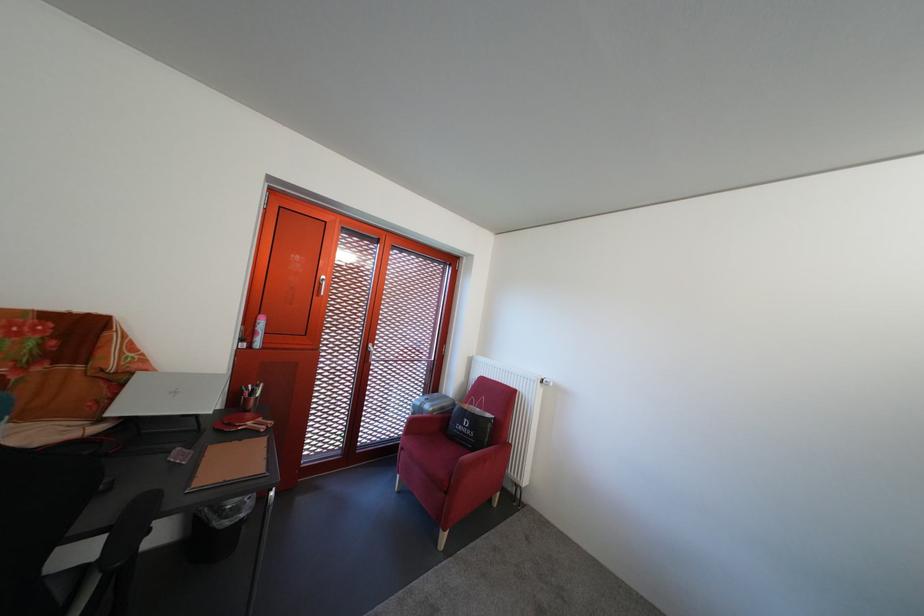
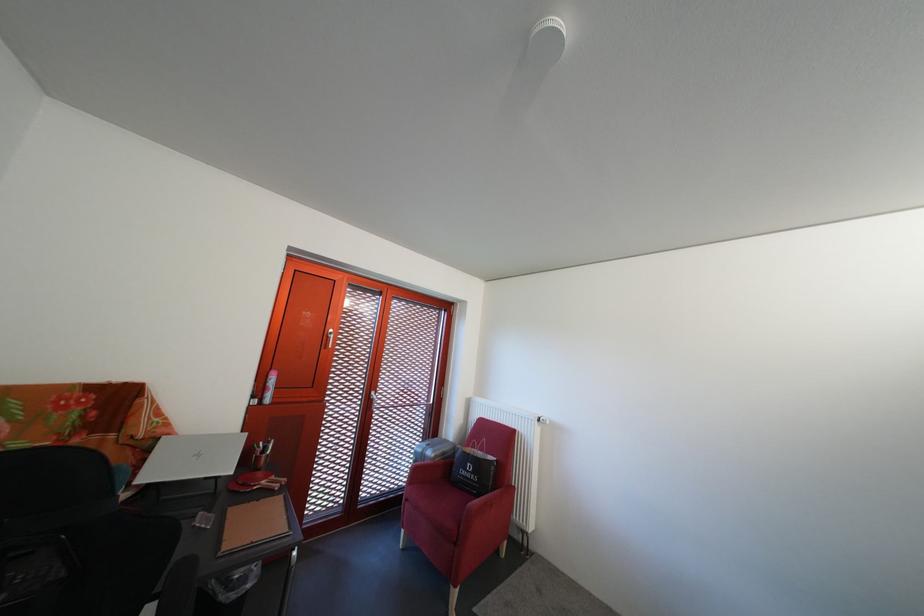
Locate, in the second image, the point that corresponds to the point at 439,413 in the first image.

(441, 459)